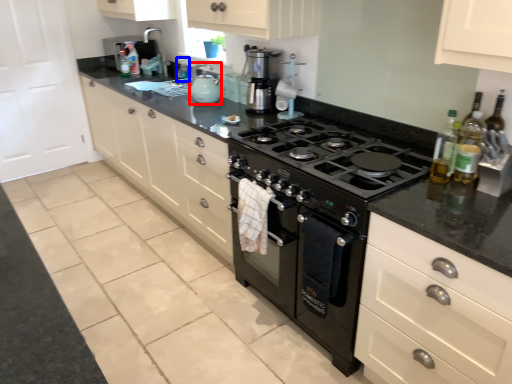
Question: Which of the following is the closest to the observer, kitchen appliance (highlighted by a red box) or bottle (highlighted by a blue box)?

Choices:
 (A) kitchen appliance
 (B) bottle

Answer: (A)